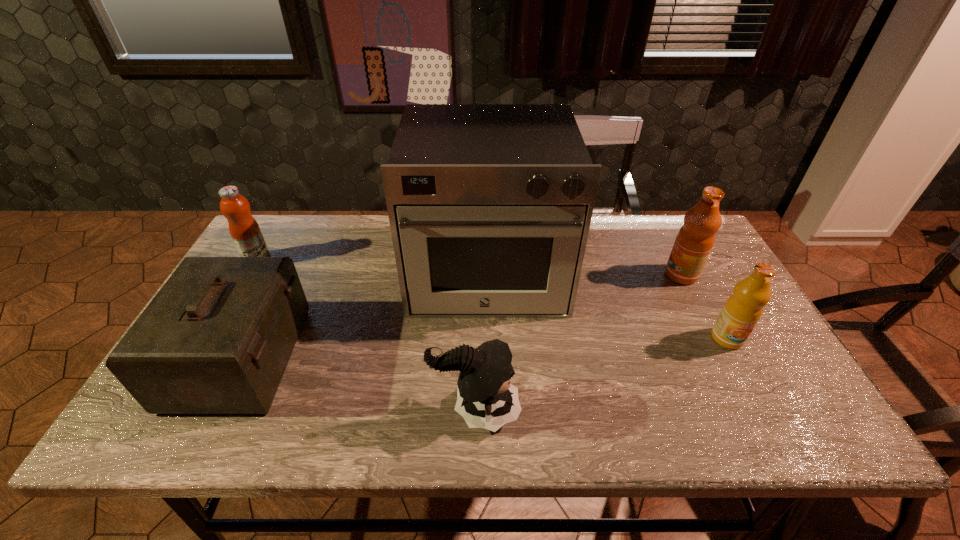
Image resolution: width=960 pixels, height=540 pixels. What are the coordinates of `free location that satisfies the following two spatial constraints: 1. on the front panel of the tallest object; 2. at the face of the doll` in the screenshot? It's located at (491, 410).